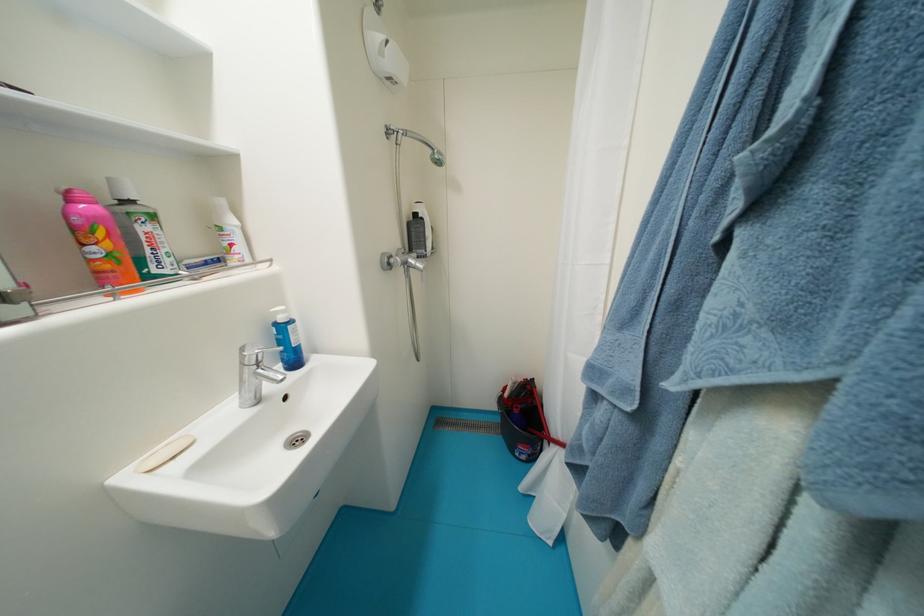
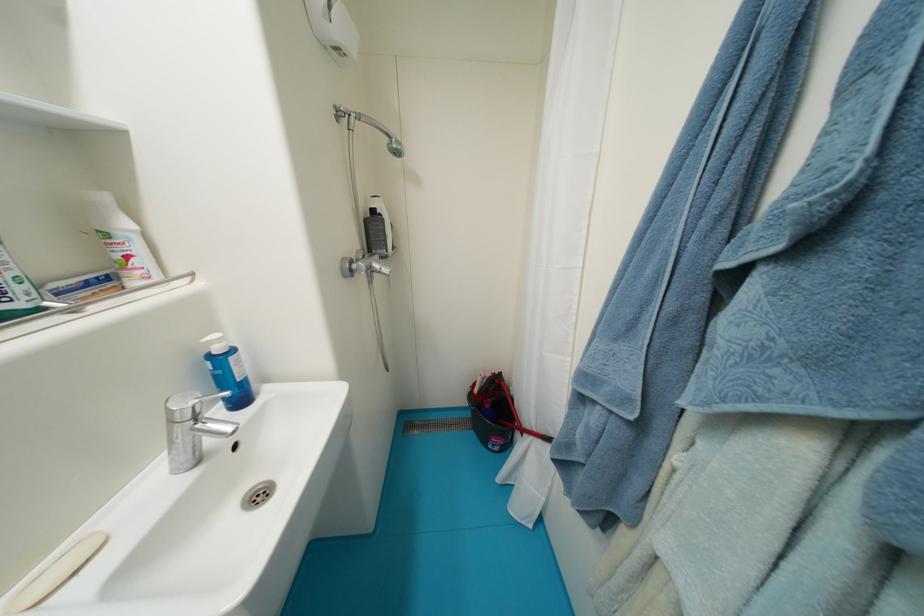
Find the pixel in the second image that matches the point at 289,314 in the first image.

(225, 342)